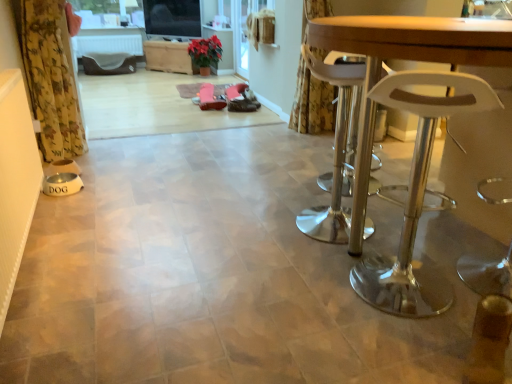
Question: Is wooden table at right in front of or behind yellow floral fabric curtain at left, which ranks as the 2th curtain in back-to-front order, in the image?

Choices:
 (A) front
 (B) behind

Answer: (A)

Question: From a real-world perspective, is wooden table at right positioned above or below yellow floral fabric curtain at left, arranged as the second curtain when viewed from the right?

Choices:
 (A) below
 (B) above

Answer: (A)

Question: Which object is positioned farthest from the yellow floral fabric curtain at left, which ranks as the 2th curtain in back-to-front order?

Choices:
 (A) green matte plant at center
 (B) clear plastic stool at right
 (C) transparent glass screen door at upper center
 (D) floral fabric curtain at upper right, the first curtain from the back
 (E) wooden table at right

Answer: (A)

Question: Based on their relative distances, which object is farther from the yellow floral fabric curtain at left, the 1th curtain in the front-to-back sequence?

Choices:
 (A) transparent glass screen door at upper center
 (B) floral fabric curtain at upper right, the first curtain from the back
 (C) green matte plant at center
 (D) clear plastic stool at right
 (E) wooden table at right

Answer: (C)